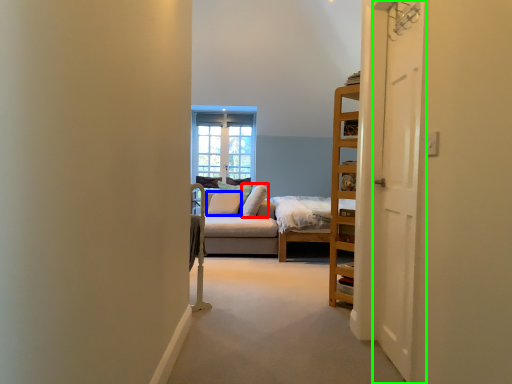
Question: Based on their relative distances, which object is farther from pillow (highlighted by a red box)? Choose from pillow (highlighted by a blue box) and door (highlighted by a green box).

Choices:
 (A) pillow
 (B) door

Answer: (B)